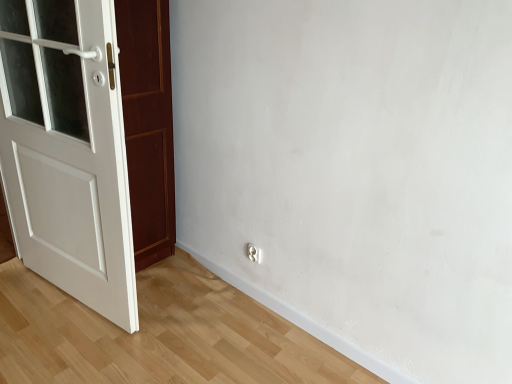
Question: Is white painted wood door at left wider than white glossy electric outlet at lower center?

Choices:
 (A) yes
 (B) no

Answer: (A)

Question: Is white painted wood door at left thinner than white glossy electric outlet at lower center?

Choices:
 (A) no
 (B) yes

Answer: (A)

Question: Is white glossy electric outlet at lower center surrounded by white painted wood door at left?

Choices:
 (A) yes
 (B) no

Answer: (B)

Question: Is white painted wood door at left next to white glossy electric outlet at lower center?

Choices:
 (A) no
 (B) yes

Answer: (A)

Question: From a real-world perspective, is white painted wood door at left over white glossy electric outlet at lower center?

Choices:
 (A) no
 (B) yes

Answer: (B)

Question: From a real-world perspective, is white painted wood door at left physically below white glossy electric outlet at lower center?

Choices:
 (A) yes
 (B) no

Answer: (B)

Question: Is white glossy electric outlet at lower center smaller than white painted wood door at left?

Choices:
 (A) no
 (B) yes

Answer: (B)

Question: Is white glossy electric outlet at lower center oriented towards white painted wood door at left?

Choices:
 (A) no
 (B) yes

Answer: (A)

Question: Is white glossy electric outlet at lower center far away from white painted wood door at left?

Choices:
 (A) yes
 (B) no

Answer: (B)

Question: Can you confirm if white glossy electric outlet at lower center is taller than white painted wood door at left?

Choices:
 (A) yes
 (B) no

Answer: (B)

Question: Would you say white glossy electric outlet at lower center is outside white painted wood door at left?

Choices:
 (A) no
 (B) yes

Answer: (B)

Question: Does white glossy electric outlet at lower center have a lesser height compared to white painted wood door at left?

Choices:
 (A) no
 (B) yes

Answer: (B)

Question: In the image, is white glossy electric outlet at lower center positioned in front of or behind white painted wood door at left?

Choices:
 (A) front
 (B) behind

Answer: (B)